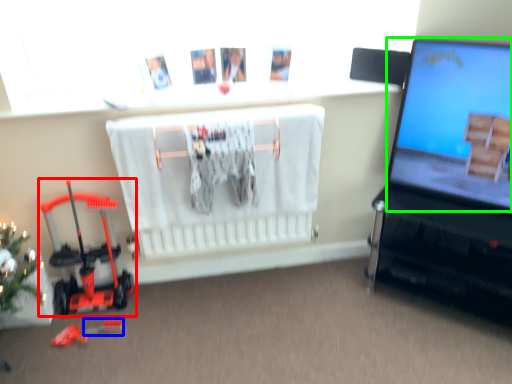
Question: Based on their relative distances, which object is nearer to toy (highlighted by a red box)? Choose from toy (highlighted by a blue box) and computer screen (highlighted by a green box).

Choices:
 (A) toy
 (B) computer screen

Answer: (A)